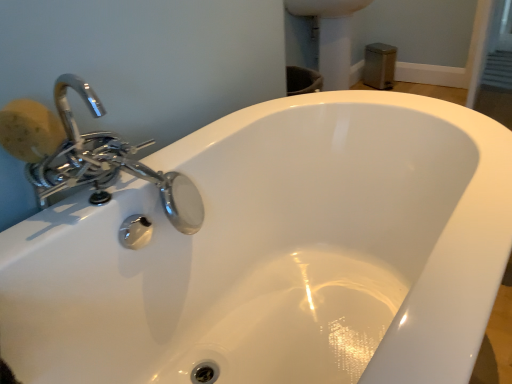
Measure the distance between point (318, 9) and camera.

They are 7.59 feet apart.

At what (x,y) coordinates should I click in order to perform the action: click on satin nickel sink at upper right. Please return your answer as a coordinate pair (x, y). This screenshot has width=512, height=384. Looking at the image, I should click on (331, 36).

This screenshot has height=384, width=512. Describe the element at coordinates (331, 36) in the screenshot. I see `satin nickel sink at upper right` at that location.

This screenshot has width=512, height=384. I want to click on yellow sponge at left, so click(x=29, y=130).

What do you see at coordinates (29, 130) in the screenshot? I see `yellow sponge at left` at bounding box center [29, 130].

Image resolution: width=512 pixels, height=384 pixels. Find the location of `satin nickel sink at upper right`. satin nickel sink at upper right is located at coordinates (331, 36).

Which object is positioned more to the right, satin nickel sink at upper right or yellow sponge at left?

satin nickel sink at upper right is more to the right.

Relative to yellow sponge at left, is satin nickel sink at upper right in front or behind?

Visually, satin nickel sink at upper right is located behind yellow sponge at left.

Considering the positions of points (304, 10) and (30, 101), is point (304, 10) closer to camera compared to point (30, 101)?

No.

From the image's perspective, between satin nickel sink at upper right and yellow sponge at left, which one is located above?

satin nickel sink at upper right is shown above in the image.

From a real-world perspective, who is located lower, satin nickel sink at upper right or yellow sponge at left?

satin nickel sink at upper right, from a real-world perspective.

Considering the sizes of objects satin nickel sink at upper right and yellow sponge at left in the image provided, who is thinner, satin nickel sink at upper right or yellow sponge at left?

Thinner between the two is yellow sponge at left.

Does satin nickel sink at upper right have a lesser height compared to yellow sponge at left?

In fact, satin nickel sink at upper right may be taller than yellow sponge at left.

Does satin nickel sink at upper right have a larger size compared to yellow sponge at left?

Yes.

Is satin nickel sink at upper right not inside yellow sponge at left?

Yes, satin nickel sink at upper right is outside of yellow sponge at left.

Is the surface of satin nickel sink at upper right in direct contact with yellow sponge at left?

No, satin nickel sink at upper right is not next to yellow sponge at left.

Is yellow sponge at left at the back of satin nickel sink at upper right?

satin nickel sink at upper right is not turned away from yellow sponge at left.

Find the location of a particular element. The width and height of the screenshot is (512, 384). soap below the satin nickel sink at upper right (from the image's perspective) is located at coordinates (29, 130).

Would you say yellow sponge at left is to the left or to the right of satin nickel sink at upper right in the picture?

Based on their positions, yellow sponge at left is located to the left of satin nickel sink at upper right.

Which object is more forward, yellow sponge at left or satin nickel sink at upper right?

yellow sponge at left is closer to the camera.

Considering the positions of point (6, 117) and point (347, 53), is point (6, 117) closer or farther from the camera than point (347, 53)?

Point (6, 117) appears to be closer to the viewer than point (347, 53).

From the image's perspective, is yellow sponge at left located beneath satin nickel sink at upper right?

Indeed, from the image's perspective, yellow sponge at left is shown beneath satin nickel sink at upper right.

From a real-world perspective, is yellow sponge at left positioned over satin nickel sink at upper right based on gravity?

Yes, from a real-world perspective, yellow sponge at left is above satin nickel sink at upper right.

Does yellow sponge at left have a lesser width compared to satin nickel sink at upper right?

Correct, the width of yellow sponge at left is less than that of satin nickel sink at upper right.

Consider the image. Considering the sizes of objects yellow sponge at left and satin nickel sink at upper right in the image provided, who is taller, yellow sponge at left or satin nickel sink at upper right?

Standing taller between the two is satin nickel sink at upper right.

Who is bigger, yellow sponge at left or satin nickel sink at upper right?

satin nickel sink at upper right is bigger.

Is yellow sponge at left not inside satin nickel sink at upper right?

Absolutely, yellow sponge at left is external to satin nickel sink at upper right.

Is yellow sponge at left in contact with satin nickel sink at upper right?

No, yellow sponge at left is not with satin nickel sink at upper right.

Is yellow sponge at left looking in the opposite direction of satin nickel sink at upper right?

yellow sponge at left does not have its back to satin nickel sink at upper right.

Find the location of a particular element. The width and height of the screenshot is (512, 384). soap in front of the satin nickel sink at upper right is located at coordinates (29, 130).

Where is `porcelain behind the yellow sponge at left`? porcelain behind the yellow sponge at left is located at coordinates (331, 36).

Where is `soap to the left of satin nickel sink at upper right`? This screenshot has width=512, height=384. soap to the left of satin nickel sink at upper right is located at coordinates (29, 130).